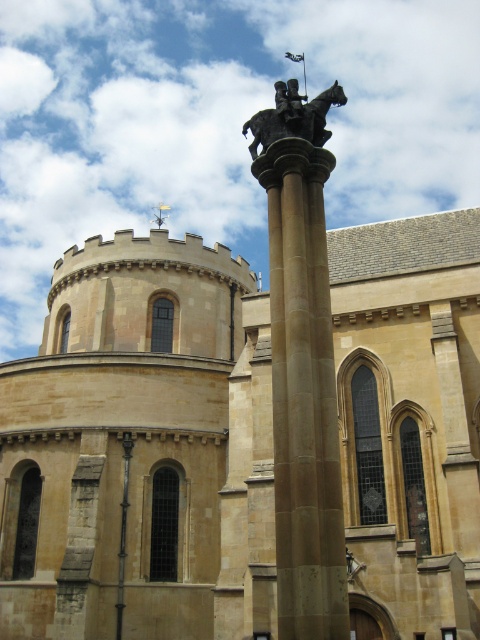
Question: In this image, where is beige stone column at center located relative to bronze statue at center?

Choices:
 (A) right
 (B) left

Answer: (B)

Question: From the image, what is the correct spatial relationship of beige stone church at center in relation to bronze statue at center?

Choices:
 (A) left
 (B) right

Answer: (A)

Question: Which object is the farthest from the bronze statue at center?

Choices:
 (A) beige stone church at center
 (B) beige stone column at center

Answer: (A)

Question: Does beige stone column at center lie behind bronze statue at center?

Choices:
 (A) yes
 (B) no

Answer: (B)

Question: Which point is farther to the camera?

Choices:
 (A) beige stone church at center
 (B) beige stone column at center
 (C) bronze statue at center

Answer: (C)

Question: Which of the following is the farthest from the observer?

Choices:
 (A) (277, 134)
 (B) (96, 340)

Answer: (B)